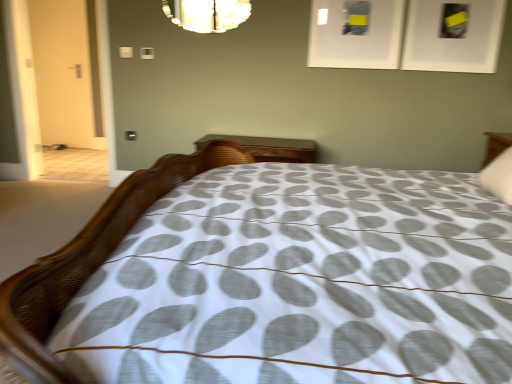
Image resolution: width=512 pixels, height=384 pixels. What do you see at coordinates (499, 176) in the screenshot?
I see `white soft pillow at upper right` at bounding box center [499, 176].

Locate an element on the screen. wooden nightstand at center is located at coordinates (271, 148).

What do you see at coordinates (207, 14) in the screenshot? I see `shiny glass mirror at upper center` at bounding box center [207, 14].

Measure the distance between white matte picture frame at upper center, the 1th picture frame from the left, and camera.

3.17 meters.

What do you see at coordinates (126, 52) in the screenshot?
I see `white matte switch at upper center` at bounding box center [126, 52].

The height and width of the screenshot is (384, 512). I want to click on white matte picture frame at upper right, positioned as the first picture frame in right-to-left order, so click(x=453, y=35).

Find the location of a particular element. The width and height of the screenshot is (512, 384). white matte door at left is located at coordinates (62, 71).

The image size is (512, 384). Find the location of `white soft pillow at upper right`. white soft pillow at upper right is located at coordinates (499, 176).

Considering the sizes of objects white textured bed at center and white matte door at left in the image provided, who is wider, white textured bed at center or white matte door at left?

With larger width is white textured bed at center.

From the image's perspective, does white textured bed at center appear higher than white matte door at left?

No.

In terms of height, does white textured bed at center look taller or shorter compared to white matte door at left?

Clearly, white textured bed at center is shorter compared to white matte door at left.

Does white textured bed at center touch white matte door at left?

No, white textured bed at center is not next to white matte door at left.

Is white matte switch at upper center aimed at white matte picture frame at upper center, the 1th picture frame from the left?

No, white matte switch at upper center is not oriented towards white matte picture frame at upper center, the 1th picture frame from the left.

Based on their sizes in the image, would you say white matte switch at upper center is bigger or smaller than white matte picture frame at upper center, arranged as the 2th picture frame when viewed from the right?

Considering their sizes, white matte switch at upper center takes up less space than white matte picture frame at upper center, arranged as the 2th picture frame when viewed from the right.

Is the depth of white matte switch at upper center less than that of white matte picture frame at upper center, the 1th picture frame from the left?

No, white matte switch at upper center is behind white matte picture frame at upper center, the 1th picture frame from the left.

Are white matte switch at upper center and white matte picture frame at upper center, arranged as the 2th picture frame when viewed from the right, far apart?

Yes, white matte switch at upper center and white matte picture frame at upper center, arranged as the 2th picture frame when viewed from the right, are quite far apart.

Considering the sizes of objects shiny glass mirror at upper center and white textured bed at center in the image provided, who is thinner, shiny glass mirror at upper center or white textured bed at center?

With smaller width is shiny glass mirror at upper center.

From a real-world perspective, which object stands above the other?

In real-world perspective, shiny glass mirror at upper center is above.

Does shiny glass mirror at upper center appear on the right side of white textured bed at center?

In fact, shiny glass mirror at upper center is to the left of white textured bed at center.

Is white matte picture frame at upper center, the 1th picture frame from the left, to the left or to the right of white soft pillow at upper right in the image?

white matte picture frame at upper center, the 1th picture frame from the left, is to the left of white soft pillow at upper right.

Are white matte picture frame at upper center, the 1th picture frame from the left, and white soft pillow at upper right far apart?

Absolutely, white matte picture frame at upper center, the 1th picture frame from the left, is distant from white soft pillow at upper right.

Is white matte picture frame at upper center, the 1th picture frame from the left, facing away from white soft pillow at upper right?

No, white soft pillow at upper right is not at the back of white matte picture frame at upper center, the 1th picture frame from the left.

From the image's perspective, which object appears higher, white matte picture frame at upper center, arranged as the 2th picture frame when viewed from the right, or white soft pillow at upper right?

white matte picture frame at upper center, arranged as the 2th picture frame when viewed from the right, appears higher in the image.

Do you think white matte door at left is within white matte picture frame at upper right, positioned as the first picture frame in right-to-left order, or outside of it?

white matte door at left exists outside the volume of white matte picture frame at upper right, positioned as the first picture frame in right-to-left order.

Are white matte door at left and white matte picture frame at upper right, the 2th picture frame positioned from the left, far apart?

white matte door at left is positioned a significant distance from white matte picture frame at upper right, the 2th picture frame positioned from the left.

Based on their sizes in the image, would you say white matte door at left is bigger or smaller than white matte picture frame at upper right, positioned as the first picture frame in right-to-left order?

Considering their sizes, white matte door at left takes up more space than white matte picture frame at upper right, positioned as the first picture frame in right-to-left order.

From the image's perspective, who appears lower, white matte door at left or white matte picture frame at upper right, the 2th picture frame positioned from the left?

white matte picture frame at upper right, the 2th picture frame positioned from the left.

Is white matte picture frame at upper center, the 1th picture frame from the left, in front of or behind shiny glass mirror at upper center in the image?

Visually, white matte picture frame at upper center, the 1th picture frame from the left, is located in front of shiny glass mirror at upper center.

Is white matte picture frame at upper center, the 1th picture frame from the left, in contact with shiny glass mirror at upper center?

They are not placed beside each other.

Consider the image. Can you confirm if white matte picture frame at upper center, arranged as the 2th picture frame when viewed from the right, is smaller than shiny glass mirror at upper center?

Yes.

Is shiny glass mirror at upper center completely or partially inside white textured bed at center?

Definitely not — shiny glass mirror at upper center is not inside white textured bed at center.

Which of these two, white textured bed at center or shiny glass mirror at upper center, stands taller?

With more height is white textured bed at center.

From a real-world perspective, which is physically below, white textured bed at center or shiny glass mirror at upper center?

white textured bed at center.

Measure the distance from white textured bed at center to shiny glass mirror at upper center.

white textured bed at center and shiny glass mirror at upper center are 2.33 meters apart from each other.

Where is `door that is above the white textured bed at center (from a real-world perspective)`? The height and width of the screenshot is (384, 512). door that is above the white textured bed at center (from a real-world perspective) is located at coordinates (62, 71).

Locate an element on the screen. The image size is (512, 384). dot located behind the white matte picture frame at upper center, the 1th picture frame from the left is located at coordinates (126, 52).

Considering their positions, is white matte picture frame at upper right, the 2th picture frame positioned from the left, positioned closer to white matte switch at upper center than white textured bed at center?

The object closer to white matte switch at upper center is white matte picture frame at upper right, the 2th picture frame positioned from the left.

Which object lies further to the anchor point white matte switch at upper center, white matte picture frame at upper right, positioned as the first picture frame in right-to-left order, or white matte picture frame at upper center, the 1th picture frame from the left?

white matte picture frame at upper right, positioned as the first picture frame in right-to-left order, is positioned further to the anchor white matte switch at upper center.

From the image, which object appears to be nearer to white matte picture frame at upper center, arranged as the 2th picture frame when viewed from the right, white matte switch at upper center or white soft pillow at upper right?

white soft pillow at upper right lies closer to white matte picture frame at upper center, arranged as the 2th picture frame when viewed from the right, than the other object.

Estimate the real-world distances between objects in this image. Which object is closer to white matte door at left, white textured bed at center or white matte picture frame at upper center, arranged as the 2th picture frame when viewed from the right?

white matte picture frame at upper center, arranged as the 2th picture frame when viewed from the right, is positioned closer to the anchor white matte door at left.

In the scene shown: Looking at the image, which one is located further to white matte picture frame at upper center, the 1th picture frame from the left, white textured bed at center or shiny glass mirror at upper center?

white textured bed at center.

Considering their positions, is shiny glass mirror at upper center positioned further to wooden nightstand at center than white matte switch at upper center?

Among the two, white matte switch at upper center is located further to wooden nightstand at center.

Which object lies further to the anchor point white matte picture frame at upper right, the 2th picture frame positioned from the left, white matte switch at upper center or white matte picture frame at upper center, arranged as the 2th picture frame when viewed from the right?

Among the two, white matte switch at upper center is located further to white matte picture frame at upper right, the 2th picture frame positioned from the left.

Based on their spatial positions, is white matte picture frame at upper right, positioned as the first picture frame in right-to-left order, or white textured bed at center closer to white matte picture frame at upper center, the 1th picture frame from the left?

white matte picture frame at upper right, positioned as the first picture frame in right-to-left order.

At what (x,y) coordinates should I click in order to perform the action: click on mirror situated between white matte switch at upper center and white matte picture frame at upper right, positioned as the first picture frame in right-to-left order, from left to right. Please return your answer as a coordinate pair (x, y). This screenshot has height=384, width=512. Looking at the image, I should click on [x=207, y=14].

Where is `pillow between white matte door at left and white matte picture frame at upper right, the 2th picture frame positioned from the left, in the horizontal direction`? pillow between white matte door at left and white matte picture frame at upper right, the 2th picture frame positioned from the left, in the horizontal direction is located at coordinates (499, 176).

The image size is (512, 384). Find the location of `nightstand between white matte door at left and white matte picture frame at upper right, positioned as the first picture frame in right-to-left order, from left to right`. nightstand between white matte door at left and white matte picture frame at upper right, positioned as the first picture frame in right-to-left order, from left to right is located at coordinates (271, 148).

This screenshot has width=512, height=384. In order to click on nightstand between shiny glass mirror at upper center and white matte picture frame at upper center, arranged as the 2th picture frame when viewed from the right in this screenshot , I will do `click(271, 148)`.